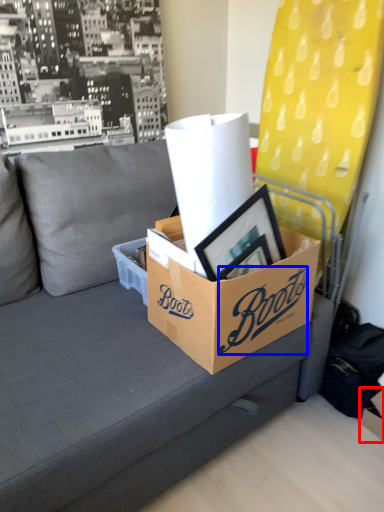
Question: Which point is closer to the camera, storage box (highlighted by a red box) or writing (highlighted by a blue box)?

Choices:
 (A) storage box
 (B) writing

Answer: (B)